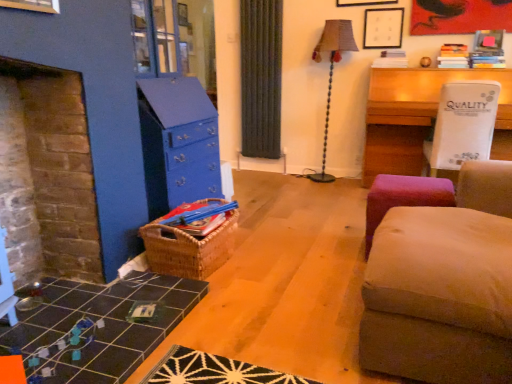
At what (x,y) coordinates should I click in order to perform the action: click on vacant space in front of woven brown basket at center. Please return your answer as a coordinate pair (x, y). The height and width of the screenshot is (384, 512). Looking at the image, I should click on (226, 301).